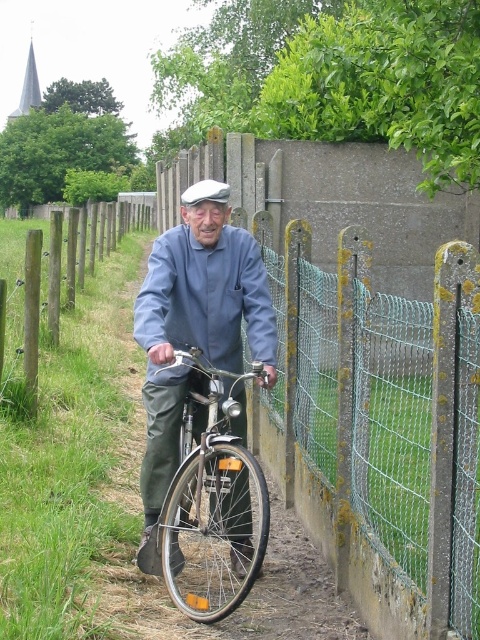
Question: Can you confirm if matte blue shirt at center is positioned below shiny silver bicycle at center?

Choices:
 (A) yes
 (B) no

Answer: (B)

Question: Which of the following is the closest to the observer?

Choices:
 (A) shiny silver bicycle at center
 (B) matte blue shirt at center

Answer: (A)

Question: Which object is the closest to the matte blue shirt at center?

Choices:
 (A) matte blue bicycle at center
 (B) shiny silver bicycle at center

Answer: (B)

Question: Does matte blue bicycle at center appear under shiny silver bicycle at center?

Choices:
 (A) yes
 (B) no

Answer: (B)

Question: Estimate the real-world distances between objects in this image. Which object is farther from the matte blue shirt at center?

Choices:
 (A) matte blue bicycle at center
 (B) shiny silver bicycle at center

Answer: (A)

Question: Is matte blue shirt at center positioned before matte blue bicycle at center?

Choices:
 (A) yes
 (B) no

Answer: (B)